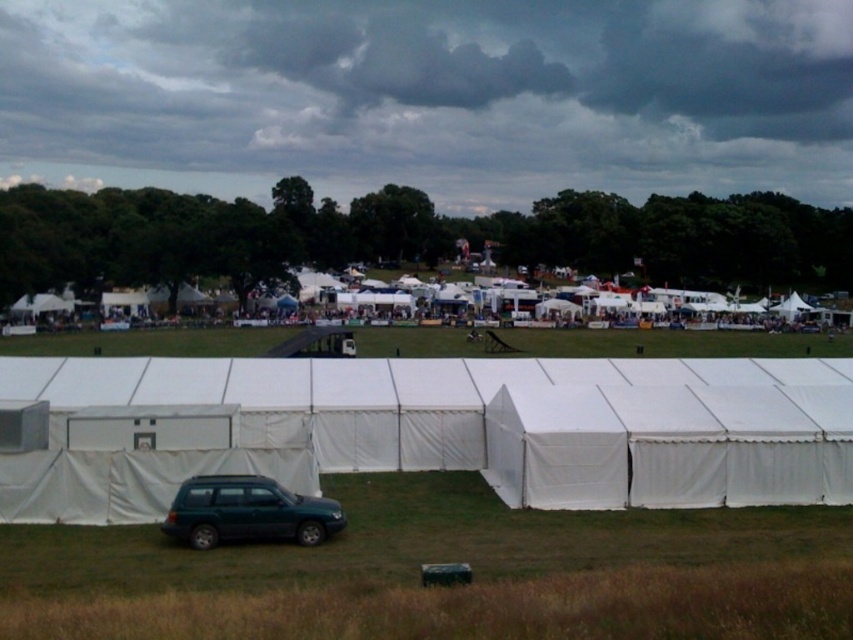
Is white fabric tent at lower center thinner than green grass at lower center?

In fact, white fabric tent at lower center might be wider than green grass at lower center.

Can you confirm if white fabric tent at lower center is positioned to the left of green grass at lower center?

Indeed, white fabric tent at lower center is positioned on the left side of green grass at lower center.

Is point (144, 365) positioned in front of point (444, 621)?

No, it is not.

You are a GUI agent. You are given a task and a screenshot of the screen. Output one action in this format:
    pyautogui.click(x=<x>, y=<y>)
    Task: Click on the white fabric tent at lower center
    
    Given the screenshot: What is the action you would take?
    pyautogui.click(x=437, y=428)

Between white fabric tent at lower center and green grass at center, which one has more height?

white fabric tent at lower center

Which is more to the left, white fabric tent at lower center or green grass at center?

white fabric tent at lower center

Which is in front, point (822, 388) or point (717, 332)?

Point (822, 388)

Identify the location of white fabric tent at lower center. (437, 428).

Does green grass at center have a smaller size compared to teal matte suv at lower center?

Incorrect, green grass at center is not smaller in size than teal matte suv at lower center.

Can you confirm if green grass at center is shorter than teal matte suv at lower center?

Incorrect, green grass at center's height does not fall short of teal matte suv at lower center's.

The image size is (853, 640). What do you see at coordinates (672, 342) in the screenshot?
I see `green grass at center` at bounding box center [672, 342].

At what (x,y) coordinates should I click in order to perform the action: click on green grass at center. Please return your answer as a coordinate pair (x, y). Looking at the image, I should click on (672, 342).